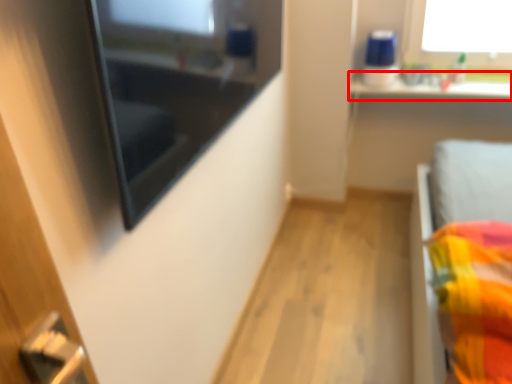
Question: Observing the image, what is the correct spatial positioning of window sill (annotated by the red box) in reference to medicine cabinet?

Choices:
 (A) right
 (B) left

Answer: (A)